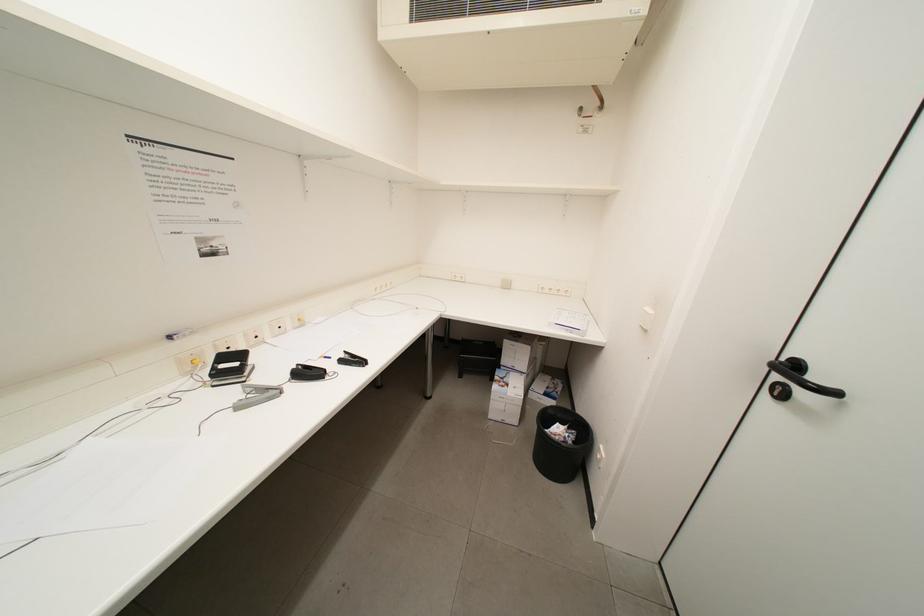
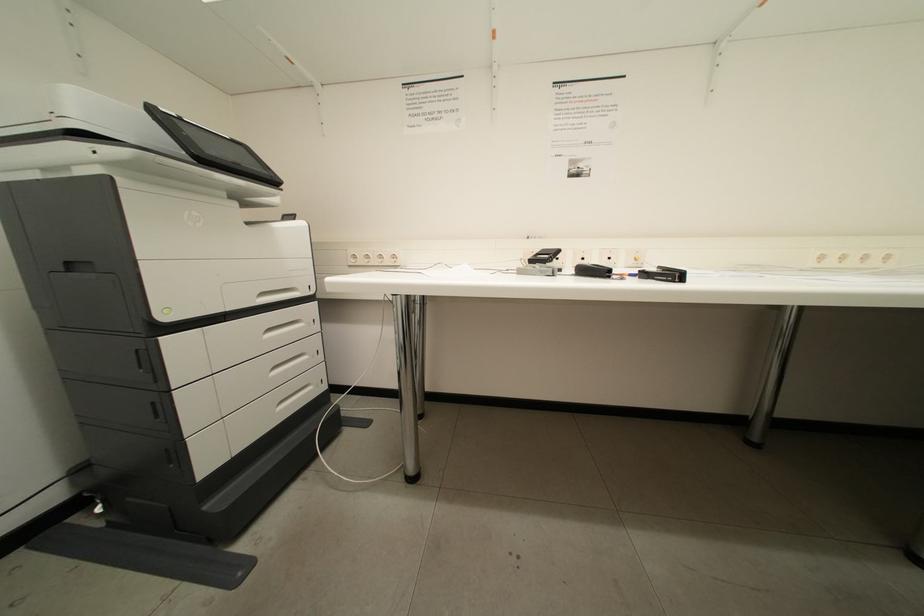
Question: The camera is either moving clockwise (left) or counter-clockwise (right) around the object. The first image is from the beginning of the video and the second image is from the end. Is the camera moving left or right when shooting the video?

Choices:
 (A) Left
 (B) Right

Answer: (B)